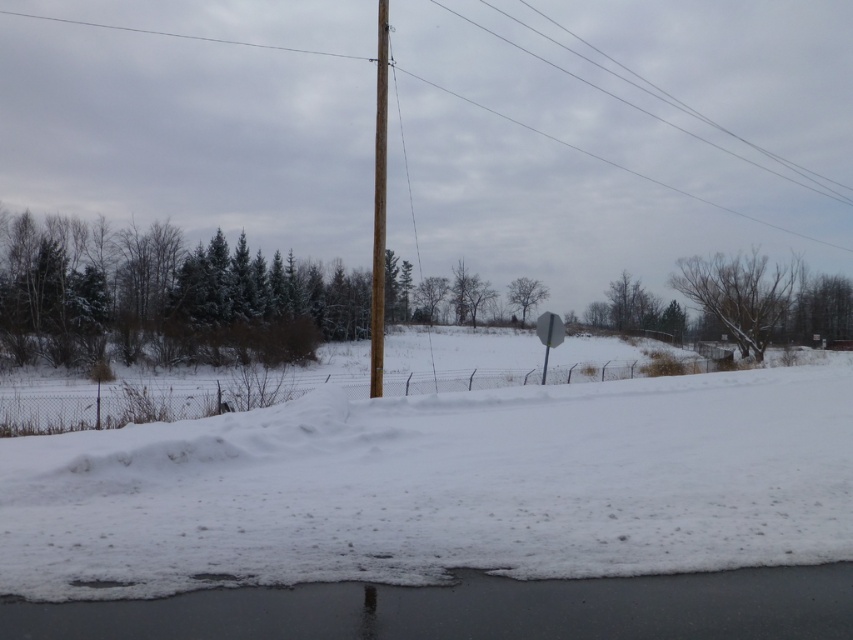
Question: Which point is closer to the camera taking this photo?

Choices:
 (A) (537, 328)
 (B) (374, 188)
 (C) (844, 8)
 (D) (408, 636)

Answer: (D)

Question: Which point is closer to the camera?

Choices:
 (A) (808, 611)
 (B) (563, 326)
 (C) (375, 186)

Answer: (A)

Question: Does white foam at lower center appear over brown wooden telegraph pole at center?

Choices:
 (A) yes
 (B) no

Answer: (B)

Question: Is brown wooden pole at center positioned behind gray matte sign at center?

Choices:
 (A) yes
 (B) no

Answer: (A)

Question: Which of the following is the closest to the observer?

Choices:
 (A) (747, 486)
 (B) (132, 625)
 (C) (375, 260)

Answer: (B)

Question: Is white fluffy snow at lower center wider than gray matte sign at center?

Choices:
 (A) no
 (B) yes

Answer: (B)